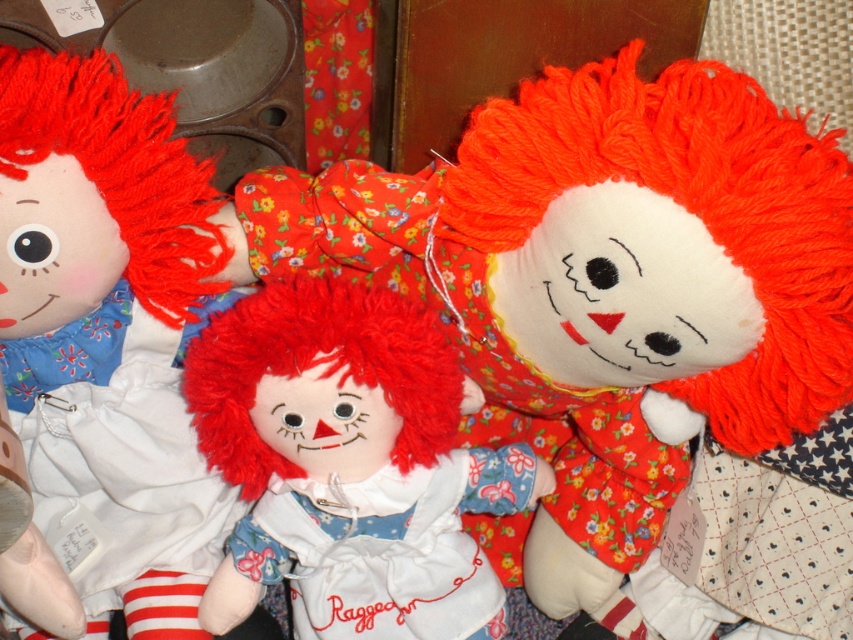
Between white soft doll at left and fluffy red hair doll at center, which one appears on the right side from the viewer's perspective?

fluffy red hair doll at center

Is white soft doll at left further to camera compared to fluffy red hair doll at center?

No, it is not.

Between point (108, 61) and point (357, 435), which one is positioned in front?

Point (108, 61)

Find the location of a particular element. The image size is (853, 640). white soft doll at left is located at coordinates (108, 337).